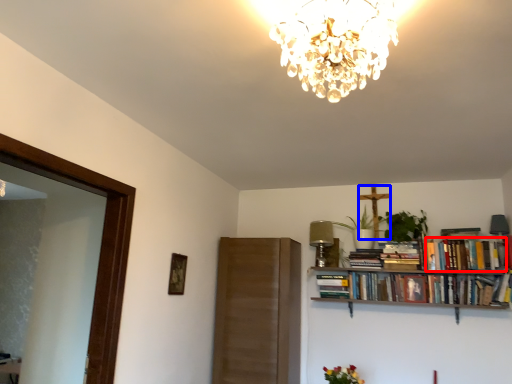
Question: Among these objects, which one is farthest to the camera, book (highlighted by a red box) or crucifix (highlighted by a blue box)?

Choices:
 (A) book
 (B) crucifix

Answer: (B)